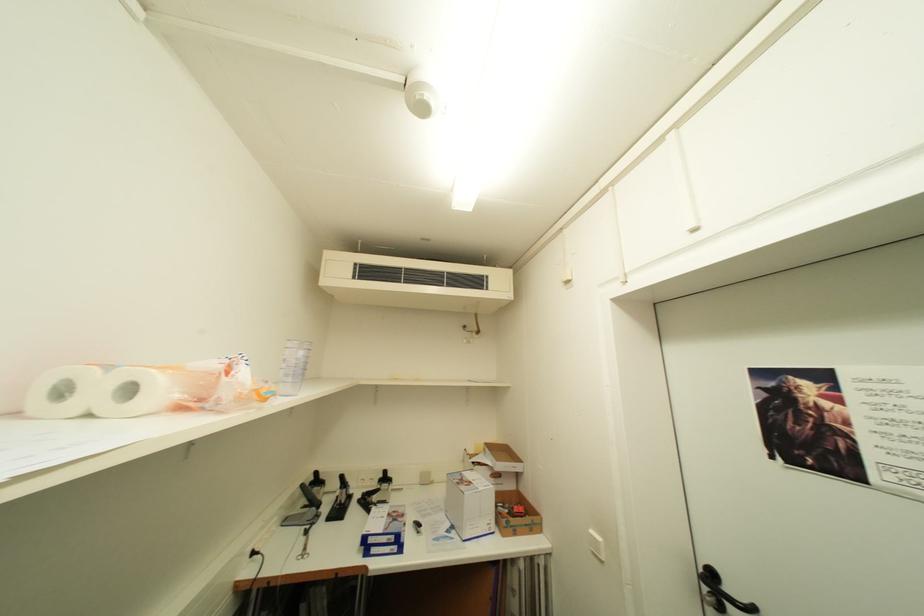
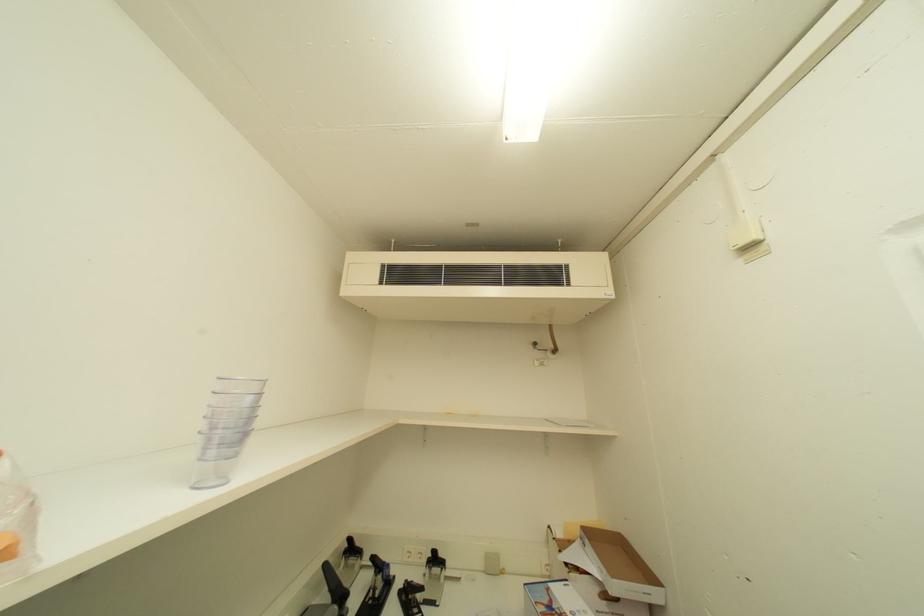
Question: The camera is either moving clockwise (left) or counter-clockwise (right) around the object. The first image is from the beginning of the video and the second image is from the end. Is the camera moving left or right when shooting the video?

Choices:
 (A) Left
 (B) Right

Answer: (B)